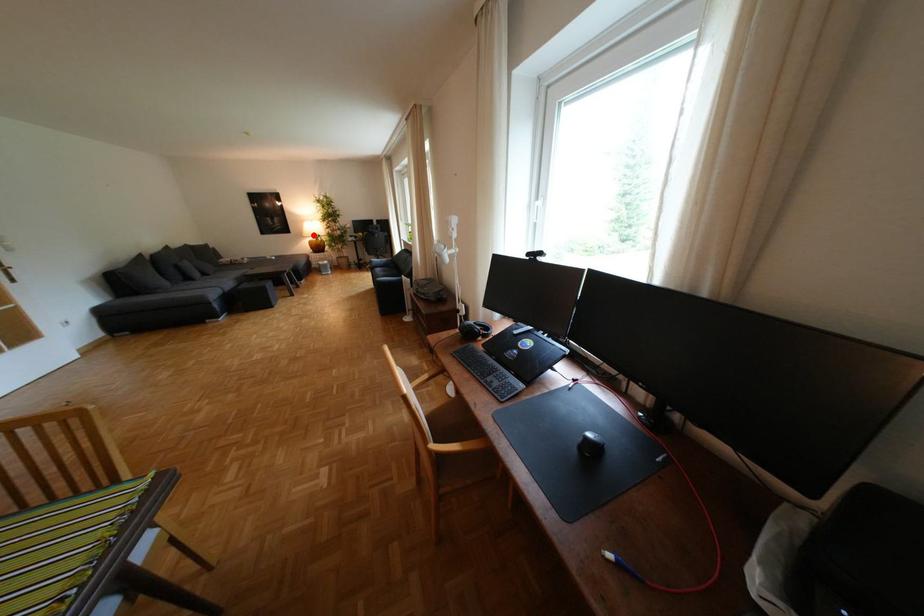
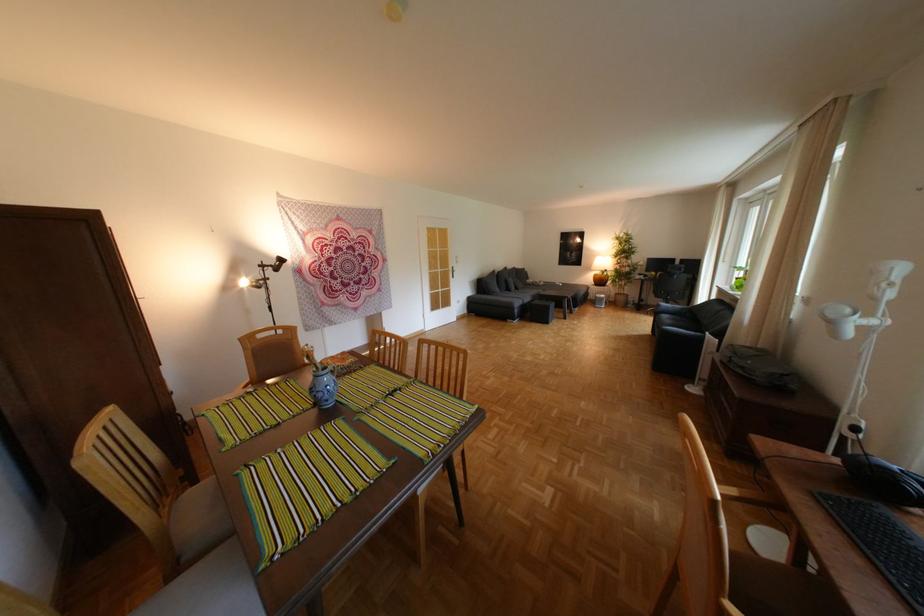
Question: I am providing you with two images of the same scene from different viewpoints. A red point is shown in image1. For the corresponding object point in image2, is it positioned nearer or farther from the camera?

Choices:
 (A) Nearer
 (B) Farther

Answer: (B)